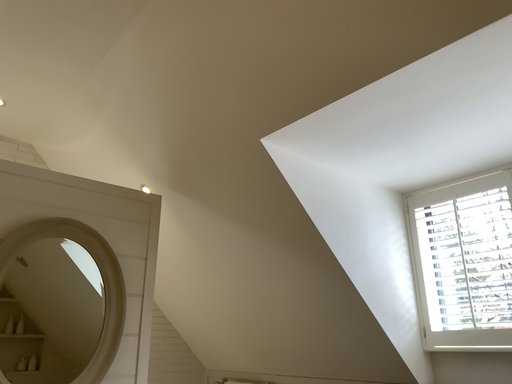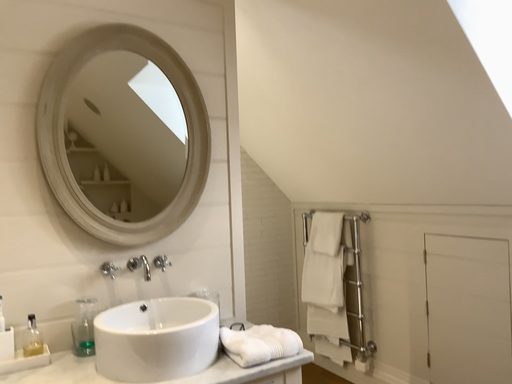
Question: Which way did the camera rotate in the video?

Choices:
 (A) rotated right
 (B) rotated left

Answer: (B)